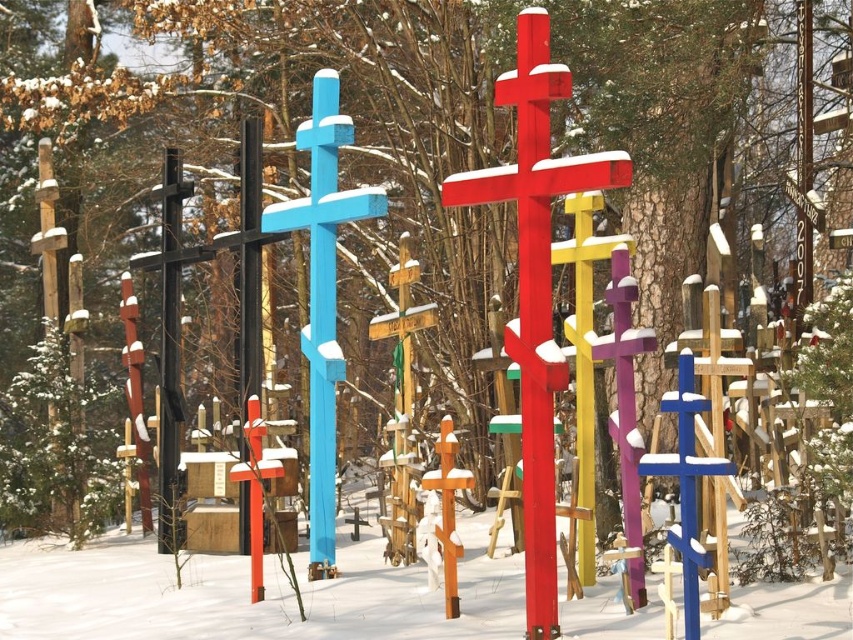
You are standing in the snowy landscape looking at the crosses. Which cross is closer to you, the smooth red wooden cross at center or the blue painted wood cross at center?

The smooth red wooden cross at center is closer to you because it is in front of the blue painted wood cross at center.

You are an artist planning to photograph the smooth red wooden cross at center and the blue painted wood cross at center from a low angle to emphasize their verticality. Which cross will appear closer to the camera in the photo?

The smooth red wooden cross at center is positioned under the blue painted wood cross at center, so when photographed from a low angle, the smooth red wooden cross at center will appear closer to the camera because it is physically lower and in front of the blue painted wood cross at center.